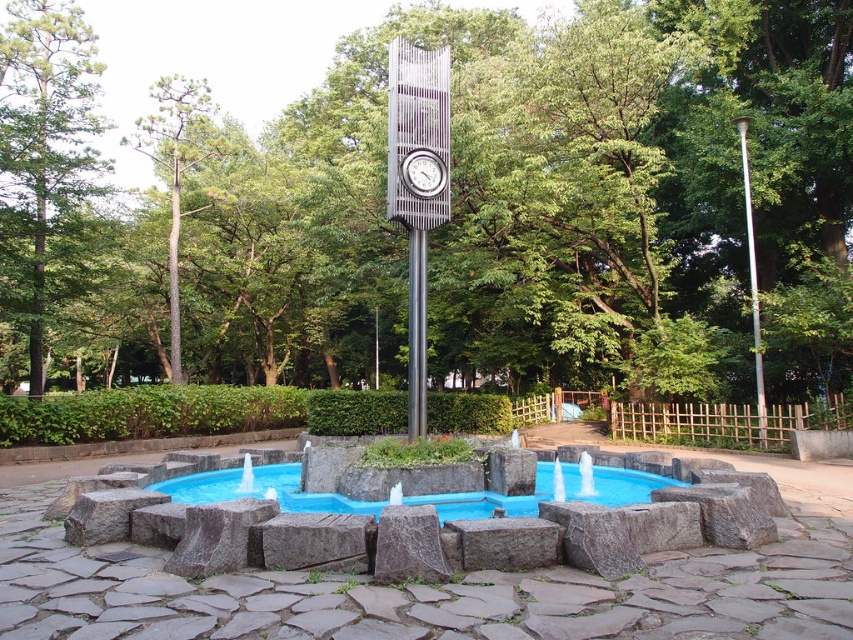
You are a park visitor who wants to take a photo of both the green leafy tree at center and the metallic clock at center in the same frame. Which object should you position closer to the camera to ensure both fit in the photo?

Since the green leafy tree at center is wider than the metallic clock at center, you should position the camera closer to the metallic clock at center so that both objects appear similar in size within the frame.

You are standing at the park entrance and want to locate the green leafy tree at center. According to the coordinates provided, where should you look relative to the fountain?

The green leafy tree at center is located at coordinates x 0.325 and y 0.641, which means it is positioned to the right and above the fountain.

You are standing at the point with coordinates (546, 208) in the park scene. What object are you located on?

The point with coordinates (546, 208) is on the green leafy tree at center.